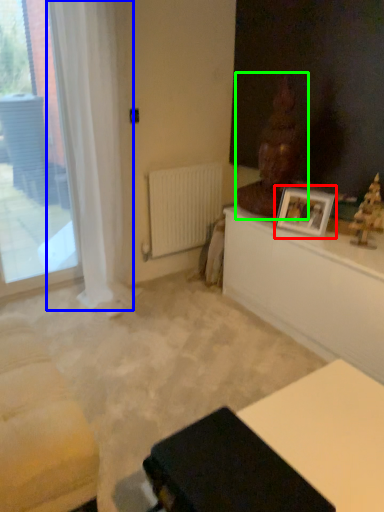
Question: Considering the real-world distances, which object is closest to picture frame (highlighted by a red box)? curtain (highlighted by a blue box) or sculpture (highlighted by a green box).

Choices:
 (A) curtain
 (B) sculpture

Answer: (B)